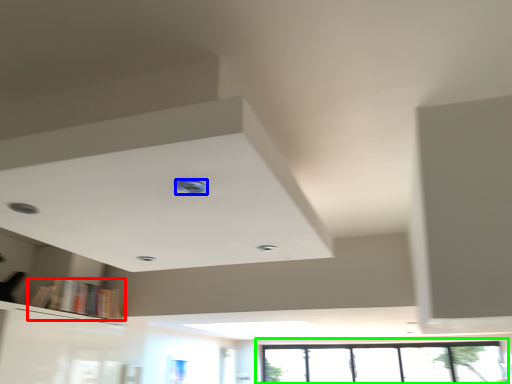
Question: Estimate the real-world distances between objects in this image. Which object is closer to book (highlighted by a red box), hole (highlighted by a blue box) or window (highlighted by a green box)?

Choices:
 (A) hole
 (B) window

Answer: (B)